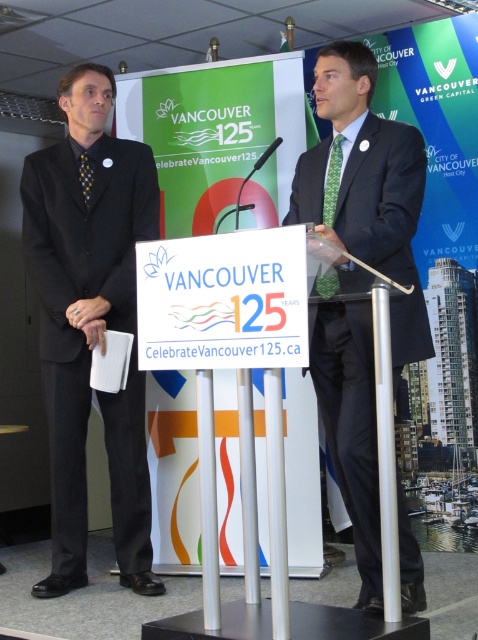
You are attending the Vancouver 125th anniversary event and want to approach the speaker. You see a black suit at left and a matte black suit at center. Which one is closer to you?

The black suit at left is closer to you because it is further to the viewer than the matte black suit at center.

You are standing in the conference hall and need to locate the person wearing the black suit at left. According to the coordinates provided, where should you look to find them?

The black suit at left is located at coordinates point (x=82, y=284).